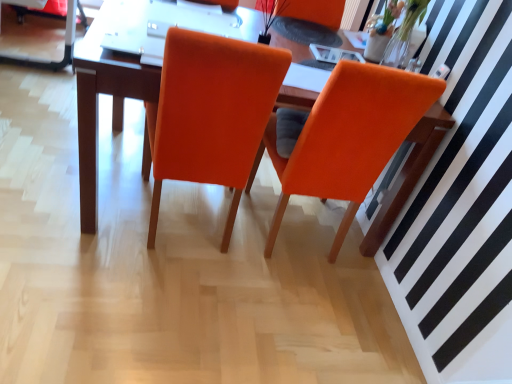
Find the location of a particular element. This screenshot has width=512, height=384. orange fabric armchair at upper center is located at coordinates (310, 21).

Image resolution: width=512 pixels, height=384 pixels. Describe the element at coordinates (310, 21) in the screenshot. I see `orange fabric armchair at upper center` at that location.

This screenshot has width=512, height=384. What do you see at coordinates (106, 92) in the screenshot?
I see `matte wood table at center` at bounding box center [106, 92].

This screenshot has height=384, width=512. I want to click on matte wood table at center, so click(106, 92).

In the scene shown: What is the approximate height of orange fabric chair at center, which is the second chair in right-to-left order?

The height of orange fabric chair at center, which is the second chair in right-to-left order, is 38.69 inches.

Measure the distance between orange fabric chair at center, the 1th chair viewed from the left, and camera.

orange fabric chair at center, the 1th chair viewed from the left, is 3.81 feet away from camera.

The image size is (512, 384). Describe the element at coordinates (347, 138) in the screenshot. I see `orange fabric chair at center, which is the first chair from right to left` at that location.

What are the coordinates of `orange fabric armchair at upper center` in the screenshot? It's located at (310, 21).

Looking at this image, between orange fabric armchair at upper center and matte wood table at center, which one is positioned behind?

Positioned behind is orange fabric armchair at upper center.

Who is taller, orange fabric armchair at upper center or matte wood table at center?

Standing taller between the two is matte wood table at center.

From the image's perspective, is orange fabric armchair at upper center beneath matte wood table at center?

No.

How many degrees apart are the facing directions of matte wood table at center and orange fabric chair at center, which is the first chair from right to left?

The angle between the facing direction of matte wood table at center and the facing direction of orange fabric chair at center, which is the first chair from right to left, is 89.6 degrees.

Is orange fabric chair at center, the second chair when ordered from left to right, completely or partially inside matte wood table at center?

Indeed, orange fabric chair at center, the second chair when ordered from left to right, is located within matte wood table at center.

Which is in front, matte wood table at center or orange fabric chair at center, which is the first chair from right to left?

orange fabric chair at center, which is the first chair from right to left.

Where is `chair that is the 1st one when counting forward from the matte wood table at center`? This screenshot has width=512, height=384. chair that is the 1st one when counting forward from the matte wood table at center is located at coordinates (347, 138).

Is orange fabric chair at center, which is the first chair from right to left, closer to camera compared to matte wood table at center?

Yes, orange fabric chair at center, which is the first chair from right to left, is closer to the camera.

From a real-world perspective, which is physically above, orange fabric chair at center, the second chair when ordered from left to right, or matte wood table at center?

In real-world perspective, orange fabric chair at center, the second chair when ordered from left to right, is above.

From the image's perspective, relative to matte wood table at center, is orange fabric chair at center, the second chair when ordered from left to right, above or below?

orange fabric chair at center, the second chair when ordered from left to right, is situated lower than matte wood table at center in the image.

Is orange fabric chair at center, which is the first chair from right to left, to the left or to the right of matte wood table at center in the image?

Clearly, orange fabric chair at center, which is the first chair from right to left, is on the right of matte wood table at center in the image.

Which is closer to the camera, [369,180] or [337,27]?

Clearly, point [369,180] is closer to the camera than point [337,27].

Find the location of a particular element. This screenshot has height=384, width=512. armchair above the orange fabric chair at center, the second chair when ordered from left to right (from a real-world perspective) is located at coordinates (310, 21).

Can you confirm if orange fabric chair at center, which is the first chair from right to left, is shorter than orange fabric armchair at upper center?

No.

From the image's perspective, which chair is the 1st one below the orange fabric armchair at upper center? Please provide its 2D coordinates.

[(211, 113)]

Can you tell me how much orange fabric armchair at upper center and orange fabric chair at center, the 1th chair viewed from the left, differ in facing direction?

orange fabric armchair at upper center and orange fabric chair at center, the 1th chair viewed from the left, are facing 0.349 degrees away from each other.

Based on the photo, is orange fabric armchair at upper center with orange fabric chair at center, the 1th chair viewed from the left?

orange fabric armchair at upper center and orange fabric chair at center, the 1th chair viewed from the left, are not in contact.

Is orange fabric armchair at upper center smaller than orange fabric chair at center, the 1th chair viewed from the left?

Correct, orange fabric armchair at upper center occupies less space than orange fabric chair at center, the 1th chair viewed from the left.

Looking at the image, does orange fabric armchair at upper center seem bigger or smaller compared to orange fabric chair at center, the second chair when ordered from left to right?

orange fabric armchair at upper center is smaller than orange fabric chair at center, the second chair when ordered from left to right.

Image resolution: width=512 pixels, height=384 pixels. I want to click on armchair above the orange fabric chair at center, the second chair when ordered from left to right (from a real-world perspective), so click(310, 21).

Would you say orange fabric armchair at upper center is inside or outside orange fabric chair at center, which is the first chair from right to left?

orange fabric armchair at upper center lies outside orange fabric chair at center, which is the first chair from right to left.

Is matte wood table at center to the right of orange fabric armchair at upper center from the viewer's perspective?

Incorrect, matte wood table at center is not on the right side of orange fabric armchair at upper center.

Can you confirm if matte wood table at center is smaller than orange fabric armchair at upper center?

Actually, matte wood table at center might be larger than orange fabric armchair at upper center.

Does matte wood table at center have a lesser width compared to orange fabric armchair at upper center?

No.

From a real-world perspective, does matte wood table at center stand above orange fabric armchair at upper center?

Incorrect, from a real-world perspective, matte wood table at center is lower than orange fabric armchair at upper center.

Find the location of a particular element. This screenshot has height=384, width=512. table located on the left of orange fabric armchair at upper center is located at coordinates (106, 92).

Identify the location of table behind the orange fabric chair at center, which is the first chair from right to left. This screenshot has height=384, width=512. 106,92.

When comparing their distances from orange fabric chair at center, which is the second chair in right-to-left order, does matte wood table at center or orange fabric armchair at upper center seem closer?

Based on the image, matte wood table at center appears to be nearer to orange fabric chair at center, which is the second chair in right-to-left order.

Estimate the real-world distances between objects in this image. Which object is further from matte wood table at center, orange fabric chair at center, which is the second chair in right-to-left order, or orange fabric chair at center, the second chair when ordered from left to right?

orange fabric chair at center, the second chair when ordered from left to right, lies further to matte wood table at center than the other object.

From the image, which object appears to be nearer to orange fabric armchair at upper center, orange fabric chair at center, which is the first chair from right to left, or orange fabric chair at center, the 1th chair viewed from the left?

The object closer to orange fabric armchair at upper center is orange fabric chair at center, which is the first chair from right to left.

Estimate the real-world distances between objects in this image. Which object is further from orange fabric armchair at upper center, orange fabric chair at center, the 1th chair viewed from the left, or matte wood table at center?

matte wood table at center is positioned further to the anchor orange fabric armchair at upper center.

Looking at the image, which one is located closer to orange fabric armchair at upper center, matte wood table at center or orange fabric chair at center, the second chair when ordered from left to right?

Based on the image, orange fabric chair at center, the second chair when ordered from left to right, appears to be nearer to orange fabric armchair at upper center.

Looking at the image, which one is located further to matte wood table at center, orange fabric armchair at upper center or orange fabric chair at center, the 1th chair viewed from the left?

Based on the image, orange fabric armchair at upper center appears to be further to matte wood table at center.

Considering their positions, is orange fabric chair at center, the second chair when ordered from left to right, positioned closer to orange fabric chair at center, which is the second chair in right-to-left order, than matte wood table at center?

matte wood table at center is positioned closer to the anchor orange fabric chair at center, which is the second chair in right-to-left order.

From the image, which object appears to be nearer to matte wood table at center, orange fabric chair at center, which is the first chair from right to left, or orange fabric chair at center, the 1th chair viewed from the left?

orange fabric chair at center, the 1th chair viewed from the left, is positioned closer to the anchor matte wood table at center.

Find the location of a particular element. table located between orange fabric chair at center, the 1th chair viewed from the left, and orange fabric armchair at upper center in the depth direction is located at coordinates (106, 92).

You are a GUI agent. You are given a task and a screenshot of the screen. Output one action in this format:
    pyautogui.click(x=<x>, y=<y>)
    Task: Click on the table situated between orange fabric chair at center, which is the second chair in right-to-left order, and orange fabric chair at center, which is the first chair from right to left, from left to right
    
    Given the screenshot: What is the action you would take?
    pyautogui.click(x=106, y=92)

Where is `table between orange fabric chair at center, which is the first chair from right to left, and orange fabric armchair at upper center in the front-back direction`? This screenshot has width=512, height=384. table between orange fabric chair at center, which is the first chair from right to left, and orange fabric armchair at upper center in the front-back direction is located at coordinates (106, 92).

Find the location of a particular element. The height and width of the screenshot is (384, 512). chair between orange fabric chair at center, the 1th chair viewed from the left, and orange fabric armchair at upper center from front to back is located at coordinates (347, 138).